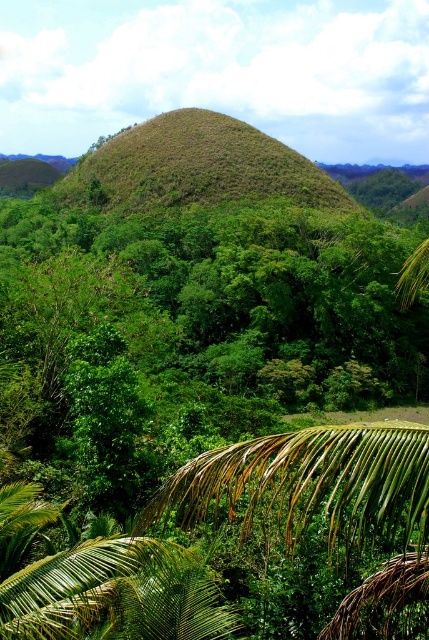
Which of these two, green leafy palm at lower center or brown grassy hill at center, stands taller?

Standing taller between the two is brown grassy hill at center.

Is green leafy palm at lower center bigger than brown grassy hill at center?

Incorrect, green leafy palm at lower center is not larger than brown grassy hill at center.

Is point (250, 524) positioned behind point (142, 125)?

No, (250, 524) is in front of (142, 125).

Identify the location of green leafy palm at lower center. The height and width of the screenshot is (640, 429). (313, 483).